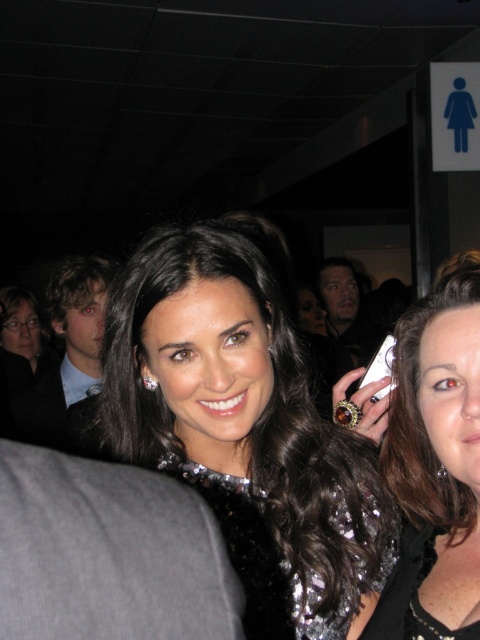
You are a photographer at the event and want to capture the woman in the foreground wearing both the shiny black dress at center and the satin black dress at center in the same frame. Since the dresses are overlapping, which dress will appear larger in the photo?

The shiny black dress at center will appear larger in the photo because it has a larger size compared to the satin black dress at center.

You are a photographer at a party and need to capture a closeup of the woman in the foreground. The camera lens can only focus on one dress at a time. Which dress should you choose to ensure the entire dress fits in the frame if the shiny black dress at center is wider than the satin black dress at center?

The shiny black dress at center is wider than the satin black dress at center, so you should choose the shiny black dress at center to ensure the entire dress fits in the frame since it requires a wider focus area.